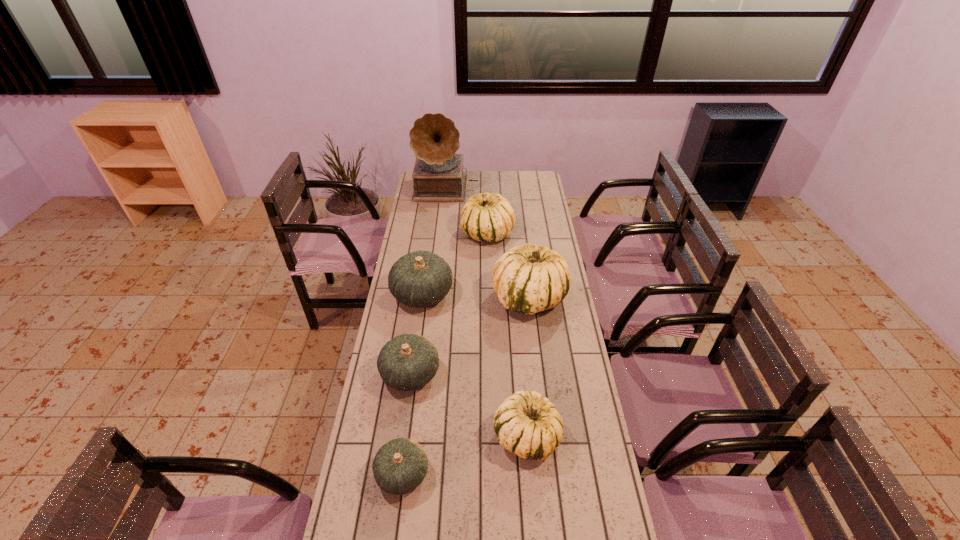
The width and height of the screenshot is (960, 540). I want to click on object that stands as the fifth closest to the nearest white gourd, so click(490, 217).

Locate which object is the fifth closest to the smallest white gourd. Please provide its 2D coordinates. Your answer should be formatted as a tuple, i.e. [(x, y)], where the tuple contains the x and y coordinates of a point satisfying the conditions above.

[(490, 217)]

Where is `gourd that is the fourth closest one to the second nearest white gourd`? Image resolution: width=960 pixels, height=540 pixels. gourd that is the fourth closest one to the second nearest white gourd is located at coordinates (526, 423).

Image resolution: width=960 pixels, height=540 pixels. What are the coordinates of `gourd that stands as the fifth closest to the farthest orange gourd` in the screenshot? It's located at (400, 466).

Identify which white gourd is the nearest to the second smallest white gourd. Please provide its 2D coordinates. Your answer should be formatted as a tuple, i.e. [(x, y)], where the tuple contains the x and y coordinates of a point satisfying the conditions above.

[(528, 278)]

Find the location of a particular element. This screenshot has width=960, height=540. white gourd that is the second closest to the second farthest object is located at coordinates (526, 423).

Identify the location of orange gourd that is the nearest to the second smallest orange gourd. The width and height of the screenshot is (960, 540). (400, 466).

Locate an element on the screen. orange gourd object that ranks as the third closest to the second nearest white gourd is located at coordinates (400, 466).

Where is `free space that satisfies the following two spatial constraints: 1. on the front side of the nearest white gourd; 2. on the left side of the farthest orange gourd`? This screenshot has width=960, height=540. free space that satisfies the following two spatial constraints: 1. on the front side of the nearest white gourd; 2. on the left side of the farthest orange gourd is located at coordinates (402, 436).

Locate an element on the screen. free space that satisfies the following two spatial constraints: 1. on the front side of the shortest object; 2. on the left side of the farthest orange gourd is located at coordinates (397, 474).